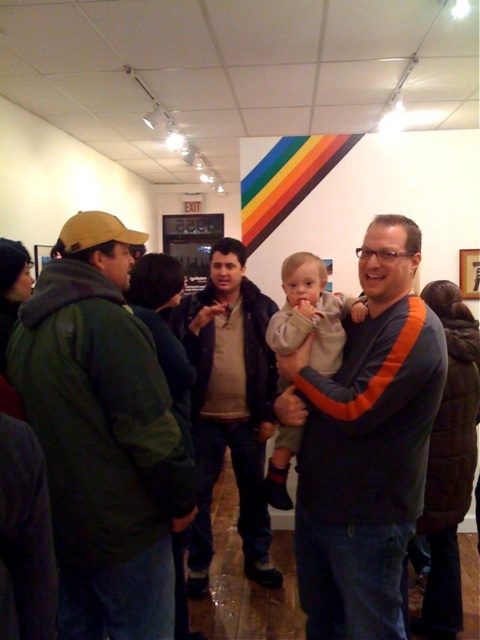
You are at the art gallery and want to find the green fleece jacket at left. According to the coordinates provided, where should you look?

You should look at point (x=103, y=436) to find the green fleece jacket at left.

You are trying to decide which jacket to borrow for a crowded event. The green fleece jacket at left and the dark brown leather jacket at center are both available. Which one do you think would be easier to wear without feeling too bulky?

The dark brown leather jacket at center is less bulky than the green fleece jacket at left, so it would be easier to wear in a crowded event.